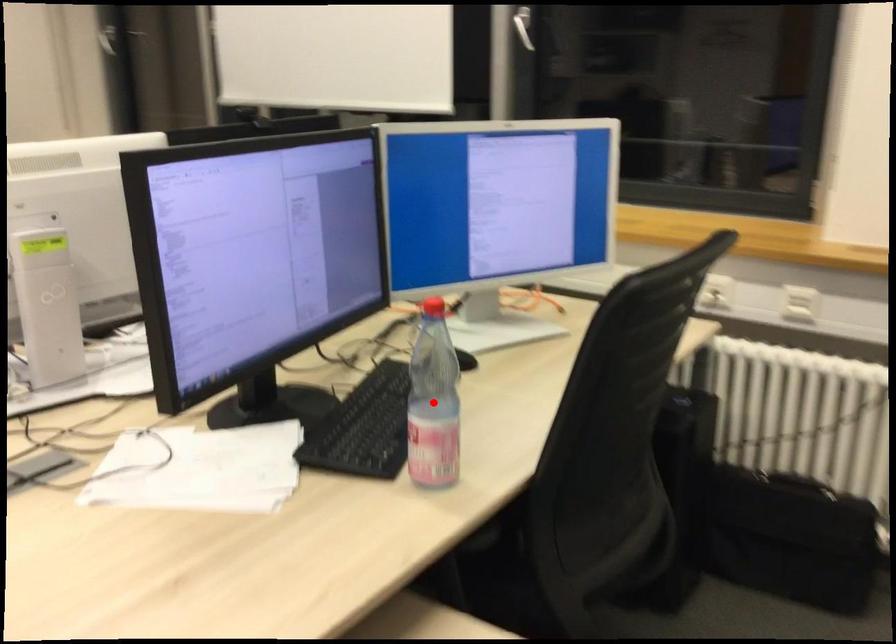
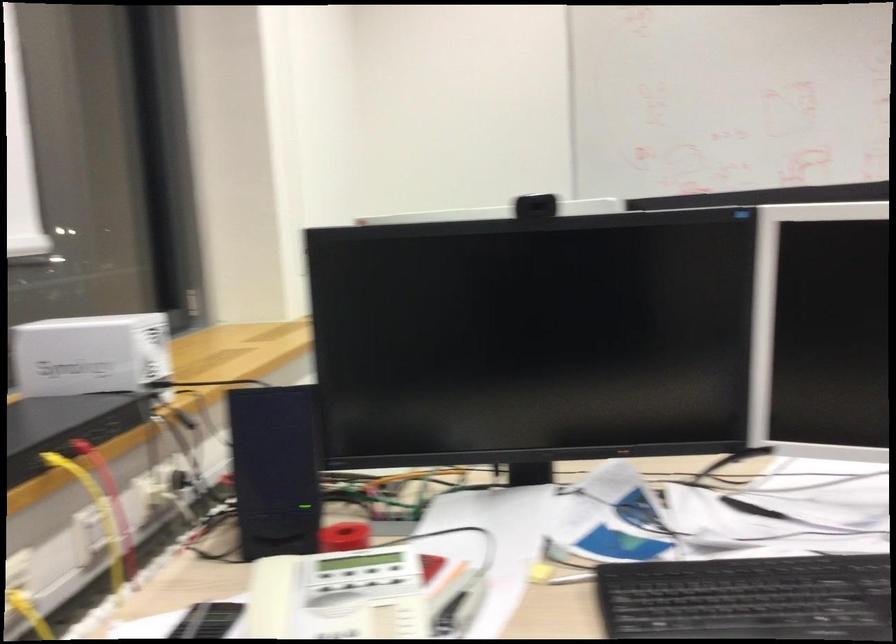
Question: I am providing you with two images of the same scene from different viewpoints. A red point is marked on the first image. At the location where the point appears in image 1, is it still visible in image 2?

Choices:
 (A) Yes
 (B) No

Answer: (B)